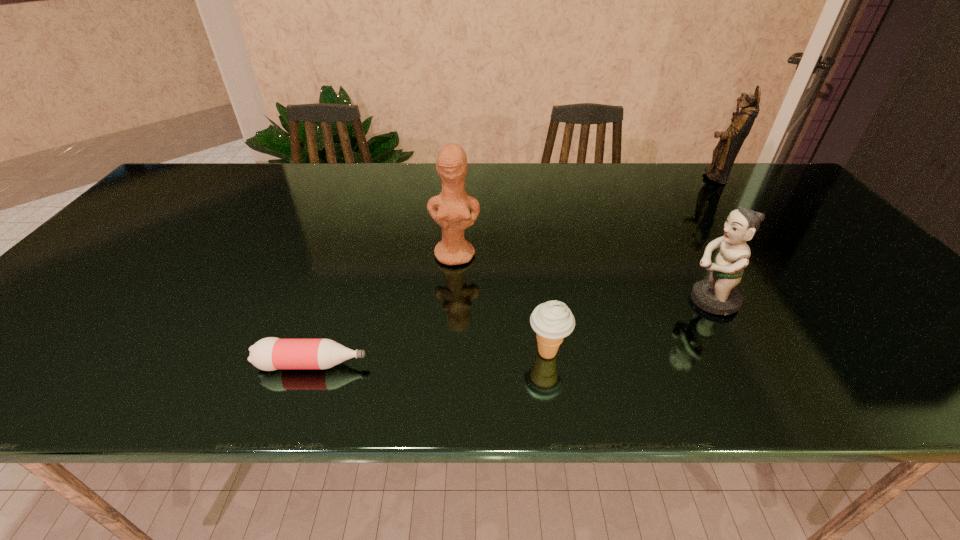
Locate an element on the screen. figurine that stands as the second closest to the fourth object from right to left is located at coordinates (724, 154).

Find the location of a particular element. The width and height of the screenshot is (960, 540). free space in the image that satisfies the following two spatial constraints: 1. on the front-facing side of the second farthest object; 2. with the cap open on the leftmost object is located at coordinates (447, 364).

Identify the location of free location that satisfies the following two spatial constraints: 1. on the front-facing side of the second nearest figurine; 2. with the cap open on the shortest object. (447, 364).

Where is `free spot that satisfies the following two spatial constraints: 1. on the front-facing side of the second shortest object; 2. on the right side of the fourth nearest object`? The width and height of the screenshot is (960, 540). free spot that satisfies the following two spatial constraints: 1. on the front-facing side of the second shortest object; 2. on the right side of the fourth nearest object is located at coordinates (448, 353).

In order to click on free space that satisfies the following two spatial constraints: 1. on the front-facing side of the farthest figurine; 2. on the front-facing side of the fourth nearest object in this screenshot , I will do `click(777, 255)`.